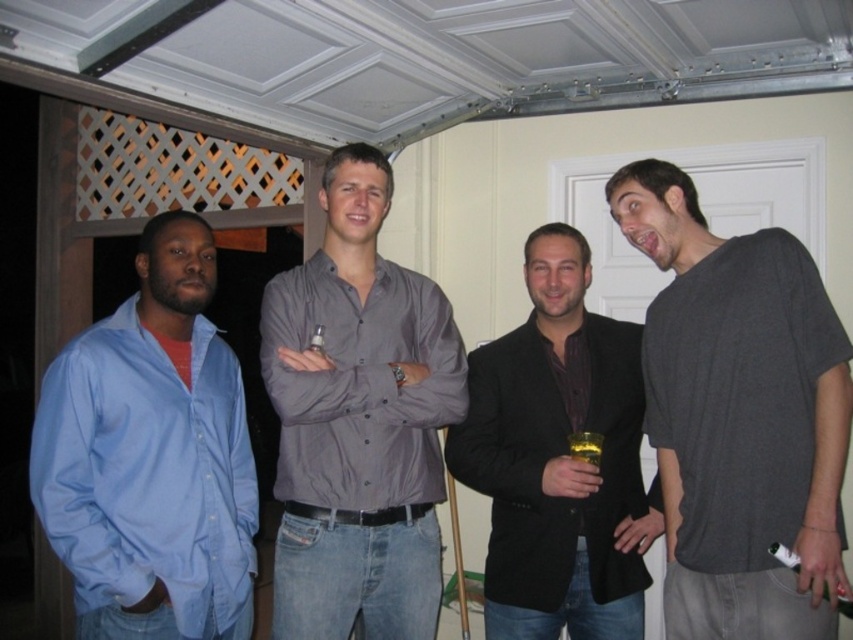
This screenshot has width=853, height=640. Describe the element at coordinates (560, 458) in the screenshot. I see `black matte blazer at center` at that location.

Which is below, black matte blazer at center or translucent glass cup at center?

Positioned lower is translucent glass cup at center.

Describe the element at coordinates (560, 458) in the screenshot. I see `black matte blazer at center` at that location.

Image resolution: width=853 pixels, height=640 pixels. Identify the location of black matte blazer at center. (560, 458).

Can you confirm if matte gray shirt at center is positioned below blue cotton shirt at left?

No, matte gray shirt at center is not below blue cotton shirt at left.

Between matte gray shirt at center and blue cotton shirt at left, which one appears on the left side from the viewer's perspective?

From the viewer's perspective, blue cotton shirt at left appears more on the left side.

Who is more forward, (395, 468) or (154, 525)?

Point (154, 525)

The width and height of the screenshot is (853, 640). Find the location of `matte gray shirt at center`. matte gray shirt at center is located at coordinates (358, 420).

Does point (639, 611) come behind point (793, 554)?

Yes, it is behind point (793, 554).

Looking at this image, between black matte blazer at center and green plastic bottle at lower right, which one appears on the left side from the viewer's perspective?

black matte blazer at center is more to the left.

This screenshot has width=853, height=640. What do you see at coordinates (560, 458) in the screenshot?
I see `black matte blazer at center` at bounding box center [560, 458].

You are a GUI agent. You are given a task and a screenshot of the screen. Output one action in this format:
    pyautogui.click(x=<x>, y=<y>)
    Task: Click on the black matte blazer at center
    This screenshot has height=640, width=853.
    Given the screenshot: What is the action you would take?
    pyautogui.click(x=560, y=458)